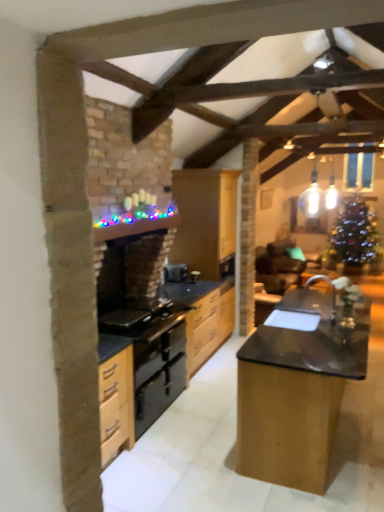
Question: Does wooden cabinets at center have a greater height compared to teal fabric armchair at center?

Choices:
 (A) yes
 (B) no

Answer: (A)

Question: Can you confirm if wooden cabinets at center is wider than teal fabric armchair at center?

Choices:
 (A) yes
 (B) no

Answer: (B)

Question: Is wooden cabinets at center to the right of teal fabric armchair at center from the viewer's perspective?

Choices:
 (A) yes
 (B) no

Answer: (B)

Question: From a real-world perspective, is wooden cabinets at center on top of teal fabric armchair at center?

Choices:
 (A) no
 (B) yes

Answer: (B)

Question: From a real-world perspective, is wooden cabinets at center under teal fabric armchair at center?

Choices:
 (A) yes
 (B) no

Answer: (B)

Question: From the image's perspective, is wooden cabinets at center over teal fabric armchair at center?

Choices:
 (A) yes
 (B) no

Answer: (A)

Question: Can you confirm if black polished wood table at center is shorter than black matte oven at center?

Choices:
 (A) yes
 (B) no

Answer: (B)

Question: Considering the relative sizes of black polished wood table at center and black matte oven at center in the image provided, is black polished wood table at center thinner than black matte oven at center?

Choices:
 (A) yes
 (B) no

Answer: (B)

Question: From the image's perspective, is black polished wood table at center located above black matte oven at center?

Choices:
 (A) no
 (B) yes

Answer: (A)

Question: Does black polished wood table at center have a greater height compared to black matte oven at center?

Choices:
 (A) yes
 (B) no

Answer: (A)

Question: Is black polished wood table at center smaller than black matte oven at center?

Choices:
 (A) no
 (B) yes

Answer: (A)

Question: Is the depth of black polished wood table at center greater than that of black matte oven at center?

Choices:
 (A) yes
 (B) no

Answer: (B)

Question: Can you confirm if teal fabric armchair at center is wider than black polished wood table at center?

Choices:
 (A) yes
 (B) no

Answer: (A)